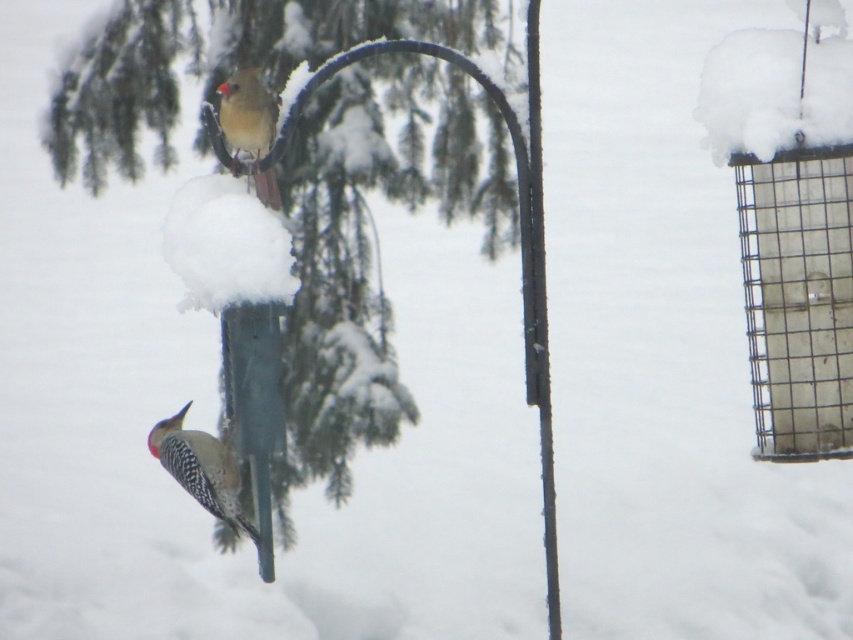
Is point (360, 99) positioned after point (254, 173)?

Yes, it is behind point (254, 173).

Measure the distance between green matte tree at center and matte brown woodpecker at upper center.

A distance of 5.81 feet exists between green matte tree at center and matte brown woodpecker at upper center.

I want to click on green matte tree at center, so click(299, 177).

Who is more distant from viewer, (344, 182) or (222, 516)?

The point (344, 182) is more distant.

The height and width of the screenshot is (640, 853). What do you see at coordinates (299, 177) in the screenshot?
I see `green matte tree at center` at bounding box center [299, 177].

Is point (115, 145) less distant than point (200, 474)?

No, (115, 145) is behind (200, 474).

The height and width of the screenshot is (640, 853). I want to click on green matte tree at center, so click(299, 177).

Which is more to the right, reddish-brown speckled woodpecker at lower left or matte brown woodpecker at upper center?

Positioned to the right is matte brown woodpecker at upper center.

Is reddish-brown speckled woodpecker at lower left further to camera compared to matte brown woodpecker at upper center?

That is True.

Find the location of a particular element. The image size is (853, 640). reddish-brown speckled woodpecker at lower left is located at coordinates (201, 468).